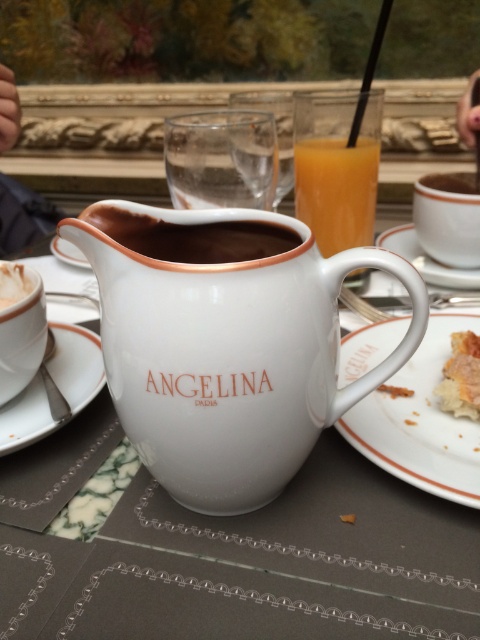
You are a customer at a cafe and want to pour the hot chocolate from the brown matte pitcher at center into the white ceramic saucer at center. Can you do this without moving the saucer? Explain why based on their positions.

The brown matte pitcher at center is in front of the white ceramic saucer at center, so you can pour the hot chocolate from the brown matte pitcher at center into the white ceramic saucer at center without moving the saucer because the pitcher is already positioned over it.